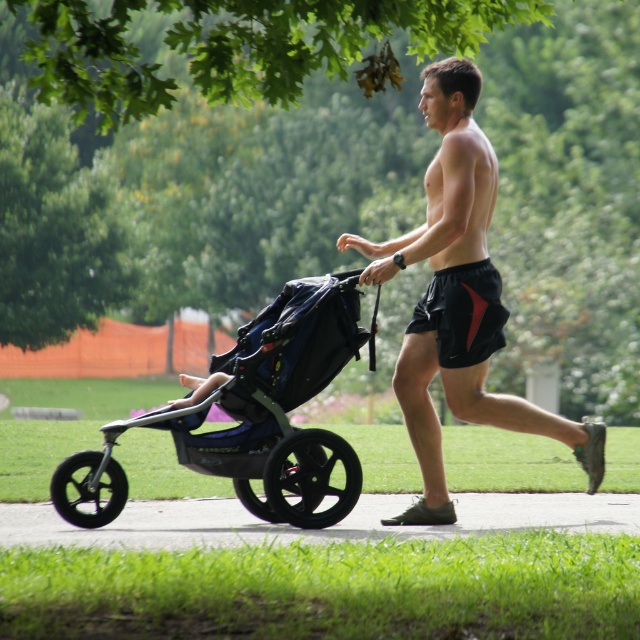
Is black rubber pavement at lower center shorter than black mesh shorts at center?

Correct, black rubber pavement at lower center is not as tall as black mesh shorts at center.

Can you confirm if black rubber pavement at lower center is positioned below black mesh shorts at center?

Indeed, black rubber pavement at lower center is positioned under black mesh shorts at center.

Is point (364, 493) in front of point (410, 332)?

No, (364, 493) is behind (410, 332).

Where is `black rubber pavement at lower center`? black rubber pavement at lower center is located at coordinates (316, 529).

Is black matte shorts at center positioned at the back of black matte stroller at left?

Yes, it is.

Between black matte shorts at center and black matte stroller at left, which one has more height?

Standing taller between the two is black matte shorts at center.

Who is more distant from viewer, (484, 404) or (259, 321)?

Point (259, 321)

Locate an element on the screen. The height and width of the screenshot is (640, 640). black matte shorts at center is located at coordinates (458, 298).

Is point (474, 189) positioned before point (440, 296)?

Yes.

Consider the image. Is black matte shorts at center bigger than black mesh shorts at center?

Yes.

Locate an element on the screen. This screenshot has height=640, width=640. black matte shorts at center is located at coordinates (458, 298).